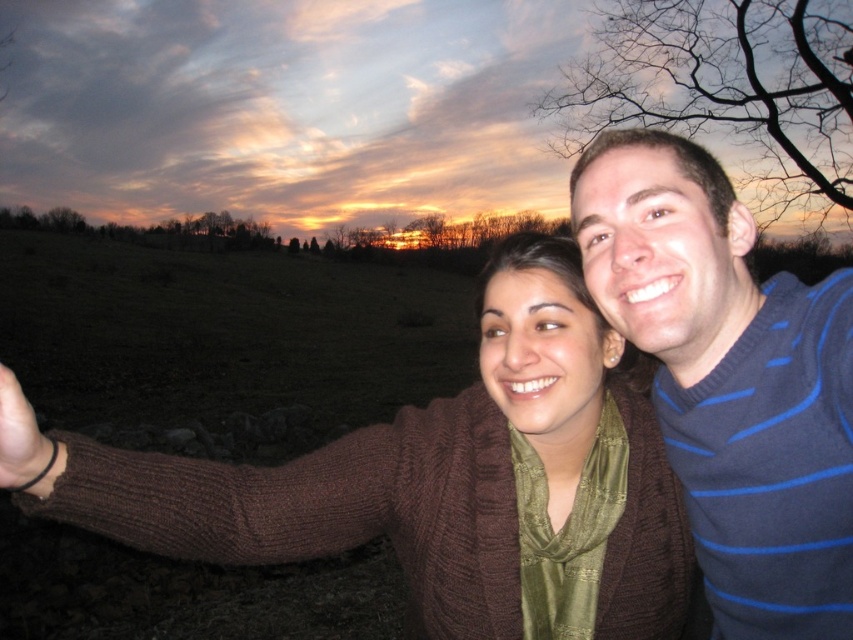
Question: Which object appears farthest from the camera in this image?

Choices:
 (A) blue striped sweater at right
 (B) smooth skin hand at lower left

Answer: (A)

Question: Which point appears farthest from the camera in this image?

Choices:
 (A) [x=44, y=486]
 (B) [x=792, y=454]

Answer: (B)

Question: Is blue striped sweater at right smaller than smooth skin hand at lower left?

Choices:
 (A) yes
 (B) no

Answer: (B)

Question: Observing the image, what is the correct spatial positioning of blue striped sweater at right in reference to smooth skin hand at lower left?

Choices:
 (A) below
 (B) above

Answer: (A)

Question: Does blue striped sweater at right appear under smooth skin hand at lower left?

Choices:
 (A) no
 (B) yes

Answer: (B)